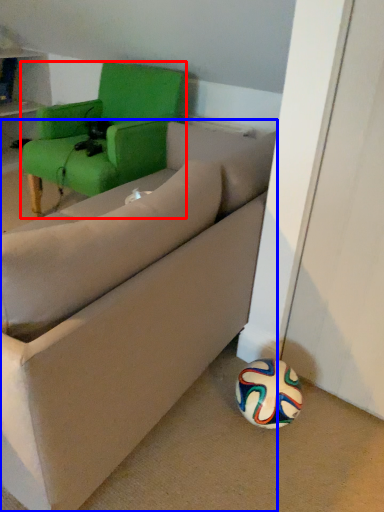
Question: Which object appears farthest to the camera in this image, chair (highlighted by a red box) or studio couch (highlighted by a blue box)?

Choices:
 (A) chair
 (B) studio couch

Answer: (A)